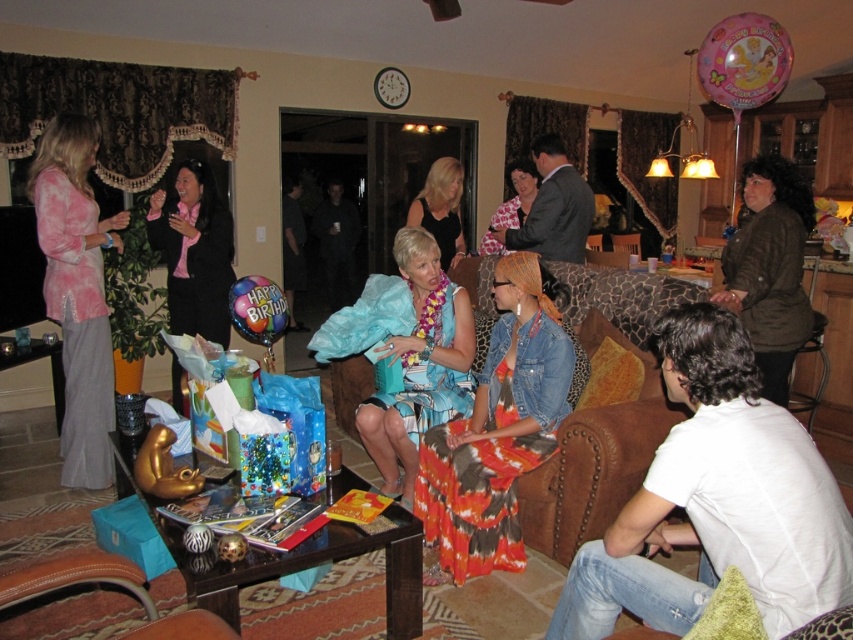
Is pink tie-dye blouse at left wider than dark brown leather jacket at right?

No, pink tie-dye blouse at left is not wider than dark brown leather jacket at right.

Between pink tie-dye blouse at left and dark brown leather jacket at right, which one is positioned lower?

pink tie-dye blouse at left is lower down.

Which is in front, point (86, 259) or point (757, 269)?

Point (757, 269)

The width and height of the screenshot is (853, 640). What are the coordinates of `pink tie-dye blouse at left` in the screenshot? It's located at (77, 291).

Does point (91, 458) lie in front of point (457, 413)?

No, it is behind (457, 413).

Who is shorter, pink tie-dye blouse at left or blue satin dress at center?

Standing shorter between the two is blue satin dress at center.

Between point (44, 211) and point (387, 355), which one is positioned behind?

The point (387, 355) is behind.

The width and height of the screenshot is (853, 640). What are the coordinates of `pink tie-dye blouse at left` in the screenshot? It's located at (77, 291).

Measure the distance from pink tie-dye blouse at left to brown leather armchair at lower left.

They are 6.32 feet apart.

Find the location of `pink tie-dye blouse at left`. pink tie-dye blouse at left is located at coordinates (77, 291).

Is point (68, 440) in front of point (78, 582)?

No.

Where is `pink tie-dye blouse at left`? The image size is (853, 640). pink tie-dye blouse at left is located at coordinates (77, 291).